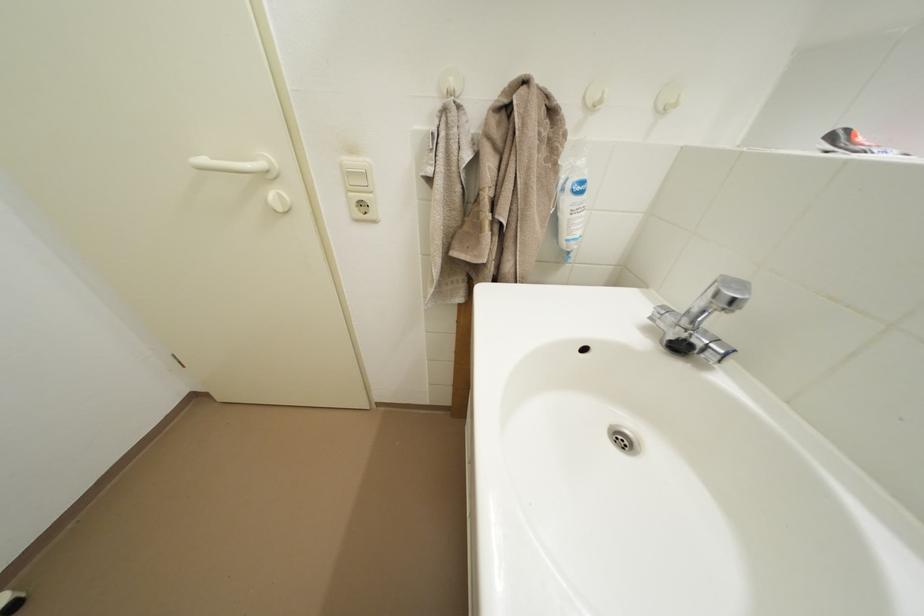
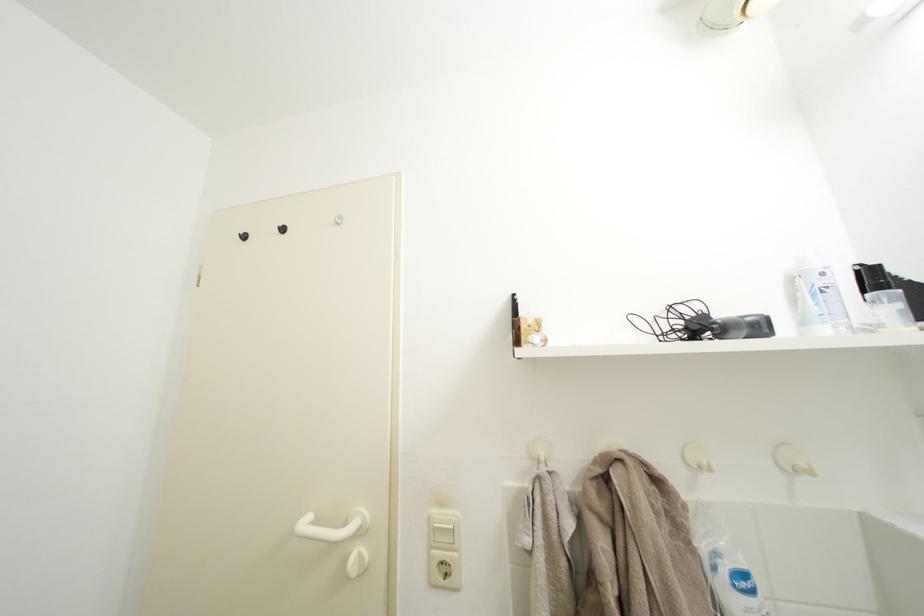
Find the pixel in the second image that matches (x=275, y=206) in the first image.

(354, 565)